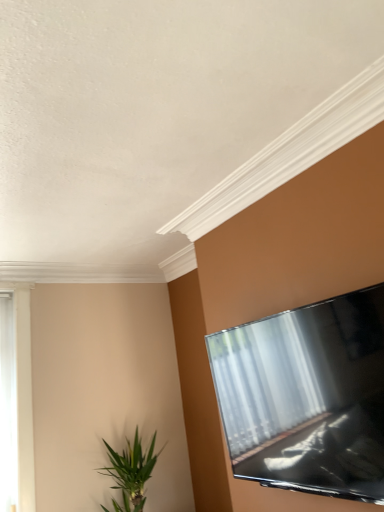
Question: From the image's perspective, relative to white wooden window at left, is green leafy plant at lower left above or below?

Choices:
 (A) above
 (B) below

Answer: (B)

Question: From a real-world perspective, relative to white wooden window at left, is green leafy plant at lower left vertically above or below?

Choices:
 (A) below
 (B) above

Answer: (A)

Question: In terms of height, does green leafy plant at lower left look taller or shorter compared to white wooden window at left?

Choices:
 (A) tall
 (B) short

Answer: (B)

Question: Is white wooden window at left wider or thinner than green leafy plant at lower left?

Choices:
 (A) thin
 (B) wide

Answer: (A)

Question: Considering the relative positions of white wooden window at left and green leafy plant at lower left in the image provided, is white wooden window at left to the left or to the right of green leafy plant at lower left?

Choices:
 (A) right
 (B) left

Answer: (B)

Question: Considering the positions of point (14, 504) and point (122, 463), is point (14, 504) closer or farther from the camera than point (122, 463)?

Choices:
 (A) closer
 (B) farther

Answer: (B)

Question: Choose the correct answer: Is white wooden window at left inside green leafy plant at lower left or outside it?

Choices:
 (A) outside
 (B) inside

Answer: (A)